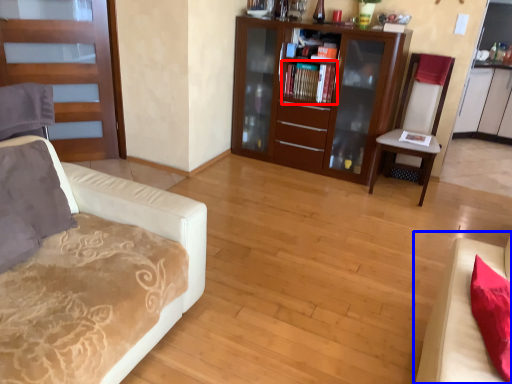
Question: Which of the following is the closest to the observer, book (highlighted by a red box) or studio couch (highlighted by a blue box)?

Choices:
 (A) book
 (B) studio couch

Answer: (B)